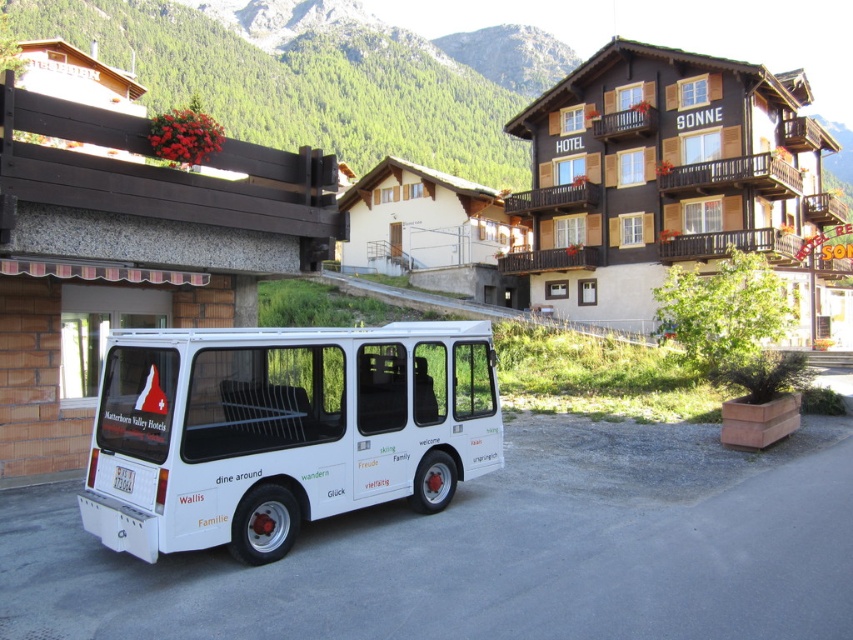
You are a tour guide planning a route for a group. The group needs to decide whether to park the white matte van at center near the brown wood overpass at upper left. Based on the scene, can the van fit in the space under the overpass?

The white matte van at center occupies less space than the brown wood overpass at upper left, so the van can fit under the overpass.

You are a tourist standing in front of the white shuttle bus parked on a paved area. You want to take a photo of the brown wooden hotel at upper center and the brown wood overpass at upper left. Which object should you focus on first to ensure both are in the frame?

The brown wooden hotel at upper center is positioned over the brown wood overpass at upper left, so you should focus on the brown wooden hotel at upper center first to ensure both are in the frame.